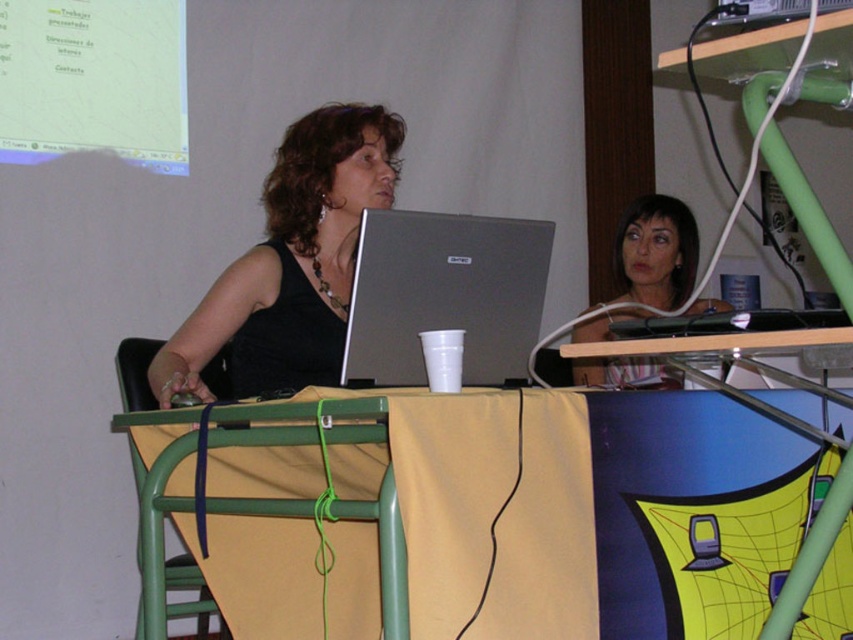
Based on the photo, you are organizing a tech event and need to place two laptops on a table. The silver metallic laptop at center and the silver metallic laptop at upper center are available. Which one requires more space on the table?

The silver metallic laptop at center requires more space on the table because it has a larger size compared to the silver metallic laptop at upper center.

You are a student who needs to reach the silver metallic laptop at center from your current position. Considering the distance between you and the laptop is 5.03 feet, can you comfortably reach it without moving your chair?

The silver metallic laptop at center is 5.03 feet away from the camera, so if you are sitting at that position, you cannot comfortably reach it without moving your chair since the typical comfortable reaching distance is about 2 feet.